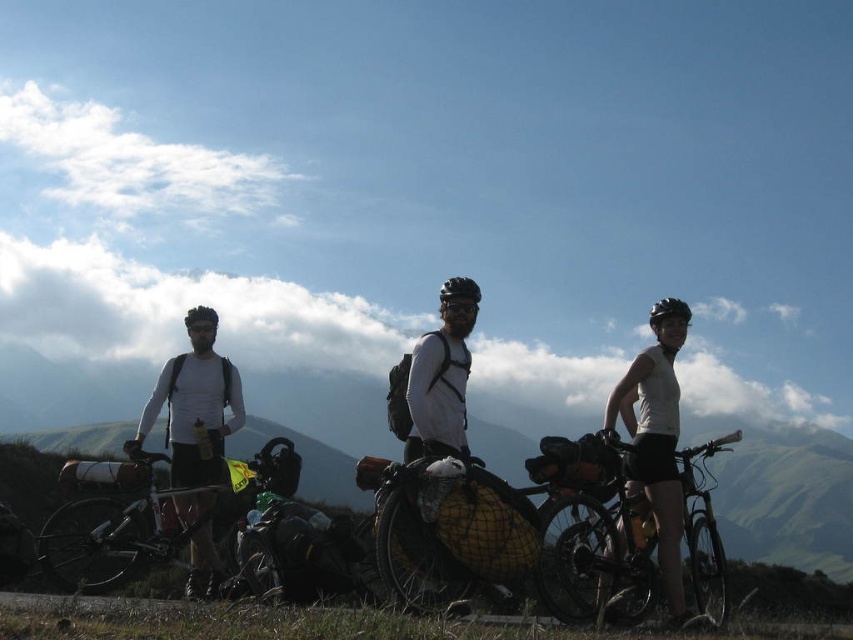
You are planning to take a photo of the matte black bicycle at center and the white matte helmet at center. Based on their positions, which object should you focus on first to ensure both are in frame?

The matte black bicycle at center is below the white matte helmet at center, so you should focus on the white matte helmet at center first to ensure both are in frame.

From the picture: You are a photographer planning to take a group photo of the matte black bicycle at center and the white matte helmet at center. Since you want to ensure both subjects are in focus, you need to know their heights. Which one is taller?

The matte black bicycle at center is much taller than the white matte helmet at center, so the bicycle should be in focus first as it is taller.

You are a photographer trying to capture a closeup shot of the black matte bicycle helmet at upper right and the black matte bicycle helmet at center. Since you want to focus on both helmets equally, which helmet requires you to adjust your camera settings to account for its larger size?

The black matte bicycle helmet at upper right requires adjusting the camera settings because it is wider than the black matte bicycle helmet at center.